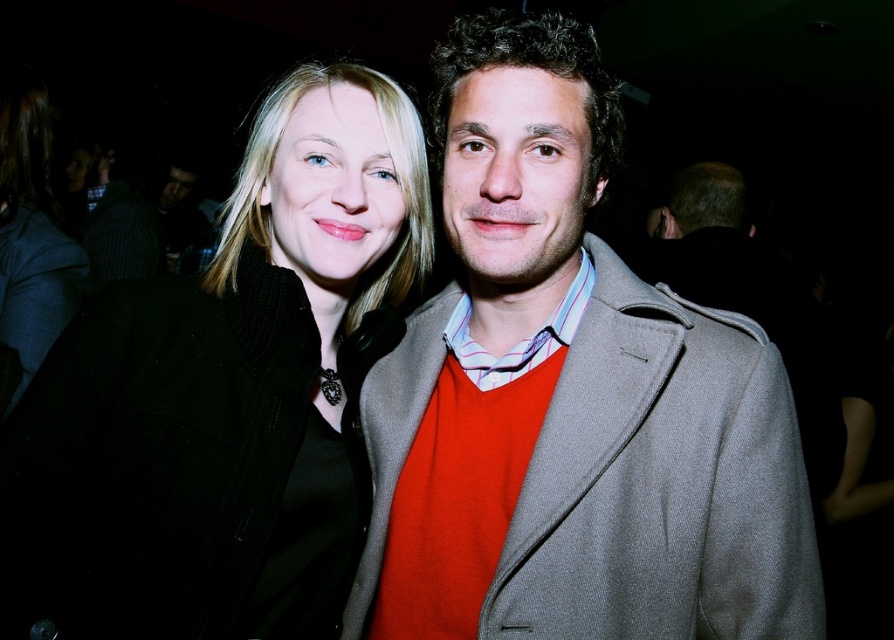
Question: Which object appears closest to the camera in this image?

Choices:
 (A) striped fabric shirt at left
 (B) black woolen coat at left
 (C) matte gray coat at center

Answer: (C)

Question: Is matte gray coat at center smaller than black woolen coat at left?

Choices:
 (A) no
 (B) yes

Answer: (B)

Question: Is matte gray coat at center positioned behind black woolen coat at left?

Choices:
 (A) no
 (B) yes

Answer: (A)

Question: Which of the following is the closest to the observer?

Choices:
 (A) matte gray coat at center
 (B) black woolen coat at left

Answer: (A)

Question: Estimate the real-world distances between objects in this image. Which object is farther from the matte gray coat at center?

Choices:
 (A) black woolen coat at left
 (B) striped fabric shirt at left

Answer: (B)

Question: Is black woolen coat at left positioned in front of striped fabric shirt at left?

Choices:
 (A) yes
 (B) no

Answer: (A)